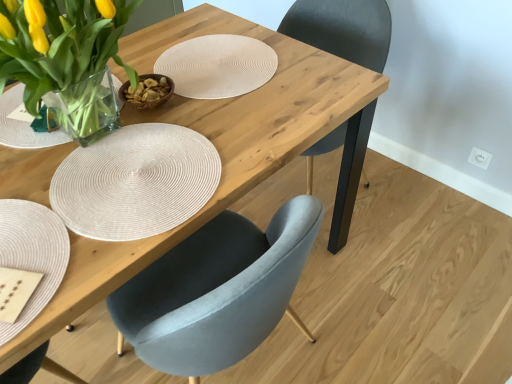
Question: Could you tell me if clear glass vase at upper left is turned towards matte gray chair at center?

Choices:
 (A) yes
 (B) no

Answer: (B)

Question: Is clear glass vase at upper left positioned behind matte gray chair at center?

Choices:
 (A) yes
 (B) no

Answer: (B)

Question: Does clear glass vase at upper left have a greater width compared to matte gray chair at center?

Choices:
 (A) yes
 (B) no

Answer: (B)

Question: Does clear glass vase at upper left have a smaller size compared to matte gray chair at center?

Choices:
 (A) yes
 (B) no

Answer: (A)

Question: From the image's perspective, is clear glass vase at upper left below matte gray chair at center?

Choices:
 (A) no
 (B) yes

Answer: (B)

Question: Relative to beige woven placemat at lower left, is clear glass vase at upper left in front or behind?

Choices:
 (A) behind
 (B) front

Answer: (A)

Question: Visually, is clear glass vase at upper left positioned to the left or to the right of beige woven placemat at lower left?

Choices:
 (A) right
 (B) left

Answer: (A)

Question: In terms of size, does clear glass vase at upper left appear bigger or smaller than beige woven placemat at lower left?

Choices:
 (A) big
 (B) small

Answer: (A)

Question: Choose the correct answer: Is clear glass vase at upper left inside beige woven placemat at lower left or outside it?

Choices:
 (A) outside
 (B) inside

Answer: (A)

Question: From their relative heights in the image, would you say matte gray chair at center is taller or shorter than clear glass vase at upper left?

Choices:
 (A) tall
 (B) short

Answer: (A)

Question: From a real-world perspective, is matte gray chair at center physically located above or below clear glass vase at upper left?

Choices:
 (A) above
 (B) below

Answer: (B)

Question: Is matte gray chair at center in front of or behind clear glass vase at upper left in the image?

Choices:
 (A) front
 (B) behind

Answer: (B)

Question: In terms of width, does matte gray chair at center look wider or thinner when compared to clear glass vase at upper left?

Choices:
 (A) thin
 (B) wide

Answer: (B)

Question: From a real-world perspective, is beige woven placemat at lower left above or below clear glass vase at upper left?

Choices:
 (A) above
 (B) below

Answer: (B)

Question: From the image's perspective, relative to clear glass vase at upper left, is beige woven placemat at lower left above or below?

Choices:
 (A) below
 (B) above

Answer: (A)